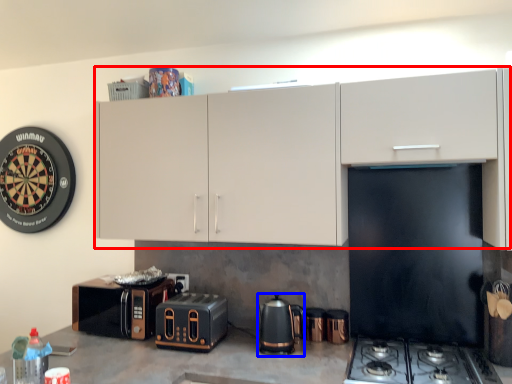
Question: Which point is closer to the camera, cabinetry (highlighted by a red box) or kitchen appliance (highlighted by a blue box)?

Choices:
 (A) cabinetry
 (B) kitchen appliance

Answer: (A)